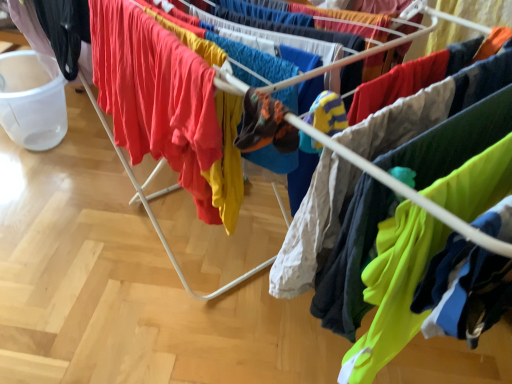
Question: Is neon green fabric at lower right, which is the 1th clothing in right-to-left order, taller or shorter than black matte pants at left, which is counted as the first clothing, starting from the left?

Choices:
 (A) short
 (B) tall

Answer: (B)

Question: Would you say neon green fabric at lower right, which is the 1th clothing in right-to-left order, is inside or outside black matte pants at left, placed as the third clothing when sorted from right to left?

Choices:
 (A) outside
 (B) inside

Answer: (A)

Question: Considering the real-world distances, which object is closest to the black matte pants at left, placed as the third clothing when sorted from right to left?

Choices:
 (A) matte red t-shirt at center, which appears as the 2th clothing when viewed from the left
 (B) neon green fabric at lower right, the 3th clothing in the left-to-right sequence

Answer: (A)

Question: Estimate the real-world distances between objects in this image. Which object is closer to the neon green fabric at lower right, which is the 1th clothing in right-to-left order?

Choices:
 (A) matte red t-shirt at center, which appears as the 2th clothing when viewed from the left
 (B) black matte pants at left, placed as the third clothing when sorted from right to left

Answer: (A)